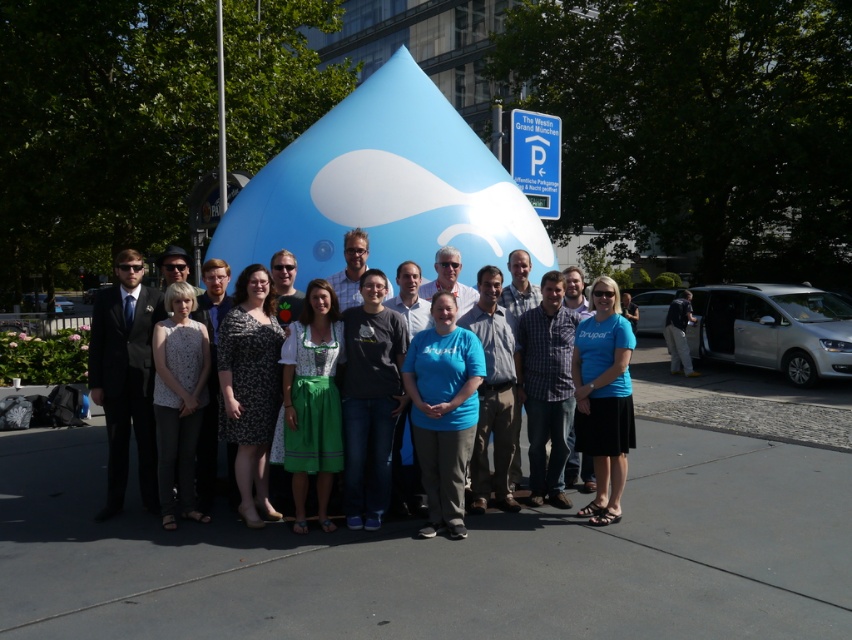
You are a photographer at the event and need to position the matte black suit at left and blue fabric dress at center so that both are clearly visible in the photo. Considering their heights, where should you place them in the frame to ensure neither is blocked?

The matte black suit at left is much taller than the blue fabric dress at center, so to prevent blocking, position the taller matte black suit at left in the back row and the shorter blue fabric dress at center in the front row.

You are organizing a photo shoot and need to place a matte black suit at left and a blue fabric dress at center in the scene. Given their sizes, which one should be positioned closer to the camera to maintain visual balance?

The matte black suit at left is larger in size than the blue fabric dress at center. To maintain visual balance, the smaller blue fabric dress at center should be positioned closer to the camera while the larger matte black suit at left can be placed farther back.

You are a photographer at the event and need to capture a photo of the matte black suit at left and the blue fabric dress at center. The camera you have can focus on subjects within a 1.5 meter range. Can you take a single photo that includes both subjects without moving the camera?

The matte black suit at left is 1.74 meters away from the blue fabric dress at center, which is beyond the camera focus range of 1.5 meters. Therefore, you cannot take a single photo that includes both subjects without moving the camera.